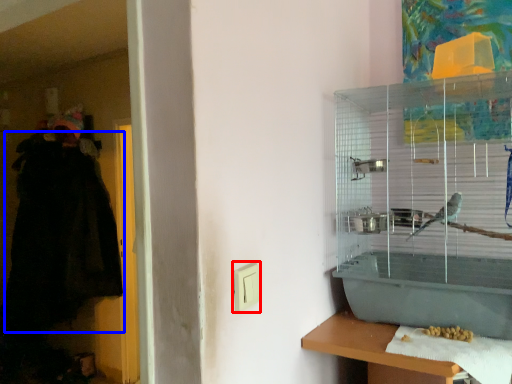
Question: Which object appears closest to the camera in this image, light switch (highlighted by a red box) or robe (highlighted by a blue box)?

Choices:
 (A) light switch
 (B) robe

Answer: (A)